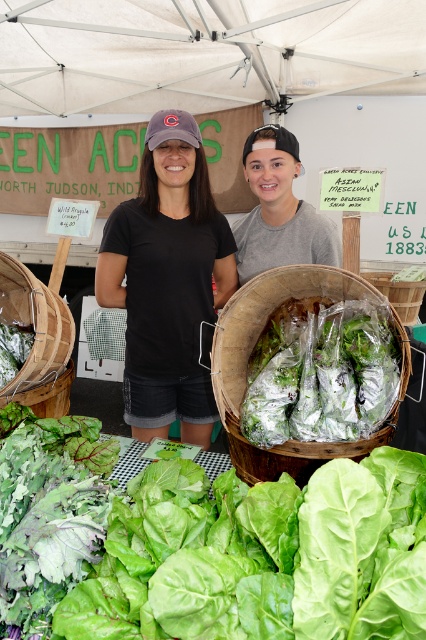
Question: Estimate the real-world distances between objects in this image. Which object is farther from the green leafy lettuce at center?

Choices:
 (A) black cotton t-shirt at center
 (B) wooden basket at lower left

Answer: (A)

Question: Is green leafy lettuce at center thinner than wooden basket at lower left?

Choices:
 (A) no
 (B) yes

Answer: (A)

Question: Among these objects, which one is farthest from the camera?

Choices:
 (A) natural wood basket at center
 (B) wooden basket at lower left
 (C) green leafy lettuce at center

Answer: (B)

Question: Which point is closer to the camera taking this photo?

Choices:
 (A) (152, 307)
 (B) (45, 413)
 (C) (270, 289)
 (D) (226, 609)

Answer: (D)

Question: In this image, where is black cotton t-shirt at center located relative to wooden basket at lower left?

Choices:
 (A) left
 (B) right

Answer: (B)

Question: Does black cotton t-shirt at center have a lesser width compared to wooden basket at lower left?

Choices:
 (A) no
 (B) yes

Answer: (A)